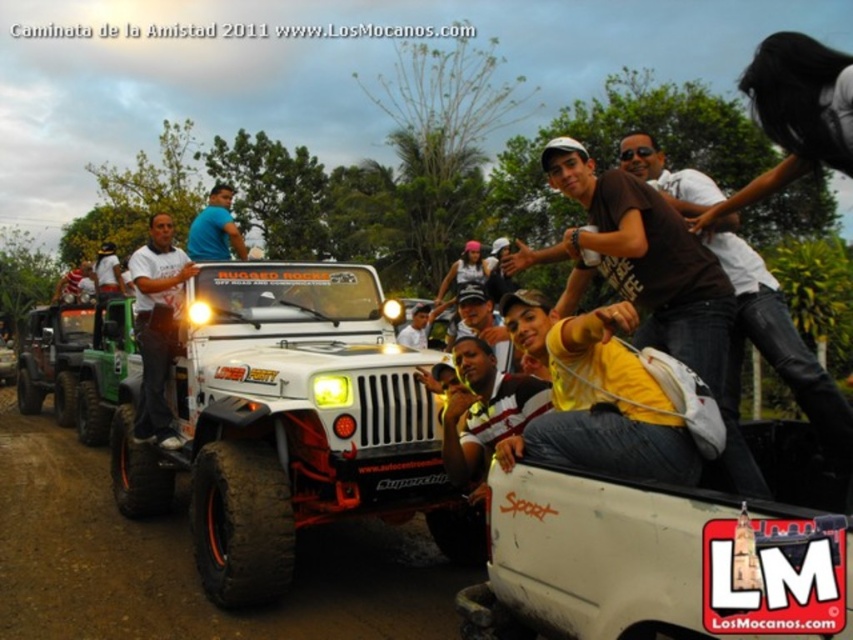
Question: Which of the following is the farthest from the observer?

Choices:
 (A) (4, 577)
 (B) (10, 376)

Answer: (B)

Question: Does matte white shirt at center appear on the left side of green matte jeep at left?

Choices:
 (A) yes
 (B) no

Answer: (B)

Question: Which point is farther to the camera?

Choices:
 (A) blue t-shirt at upper center
 (B) green matte jeep at left
 (C) brown leather shirt at upper right
 (D) black rubber tire at center

Answer: (B)

Question: Can you confirm if matte white shirt at center is smaller than blue t-shirt at upper center?

Choices:
 (A) no
 (B) yes

Answer: (B)

Question: Considering the relative positions of brown leather shirt at upper right and brushed metal truck at center in the image provided, where is brown leather shirt at upper right located with respect to brushed metal truck at center?

Choices:
 (A) below
 (B) above

Answer: (B)

Question: Based on their relative distances, which object is nearer to the blue t-shirt at upper center?

Choices:
 (A) green matte jeep at left
 (B) brushed metal truck at center
 (C) matte white shirt at center

Answer: (C)